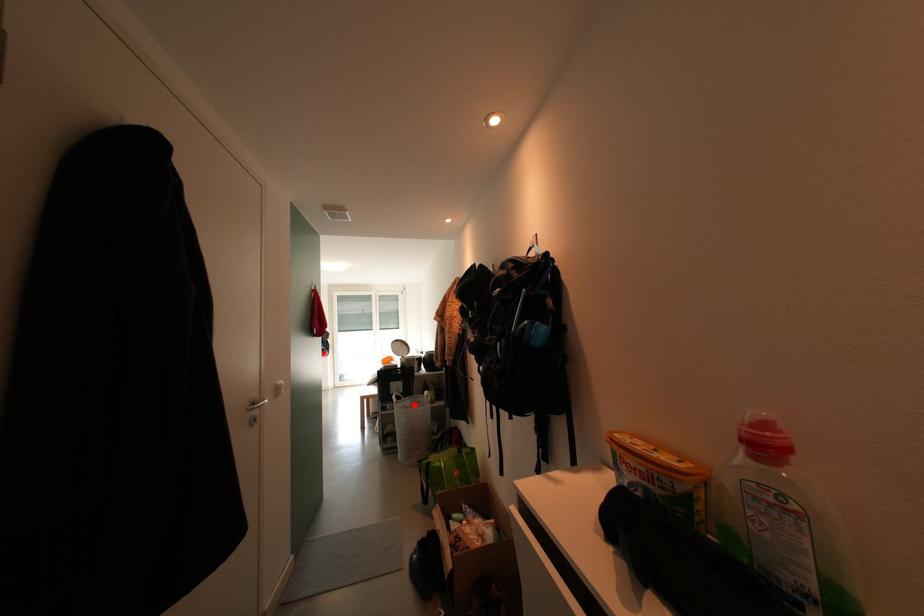
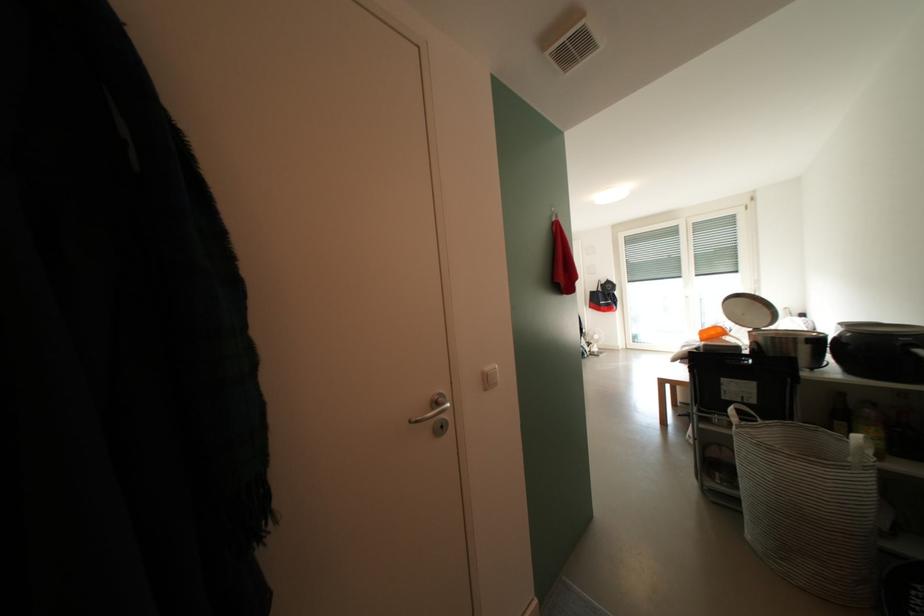
Find the pixel in the second image that matches the highlighted location in the first image.

(779, 435)